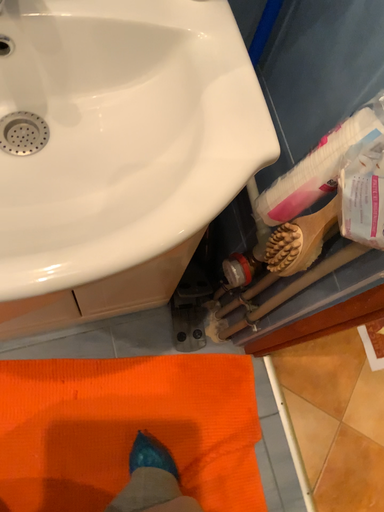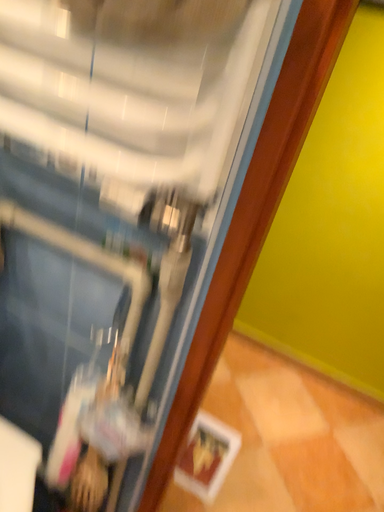
Question: How did the camera likely rotate when shooting the video?

Choices:
 (A) rotated left
 (B) rotated right

Answer: (B)